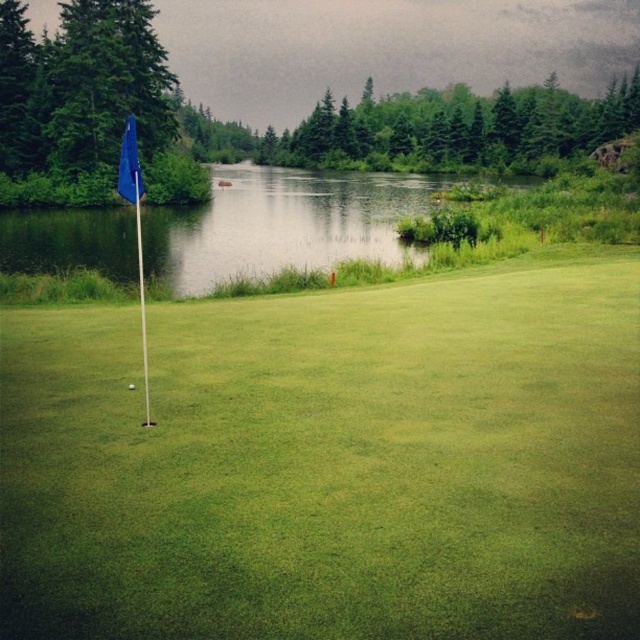
You are a golfer analyzing the putting surface. You notice the blue fabric flag at left and the white matte golf ball at center. Which object has a greater width?

The blue fabric flag at left has a greater width than the white matte golf ball at center.

You are standing on the golf course and see two points marked in the scene. Which point is nearer to you, point (109, 474) or point (129, 196)?

Point (109, 474) is closer to the viewer than point (129, 196).